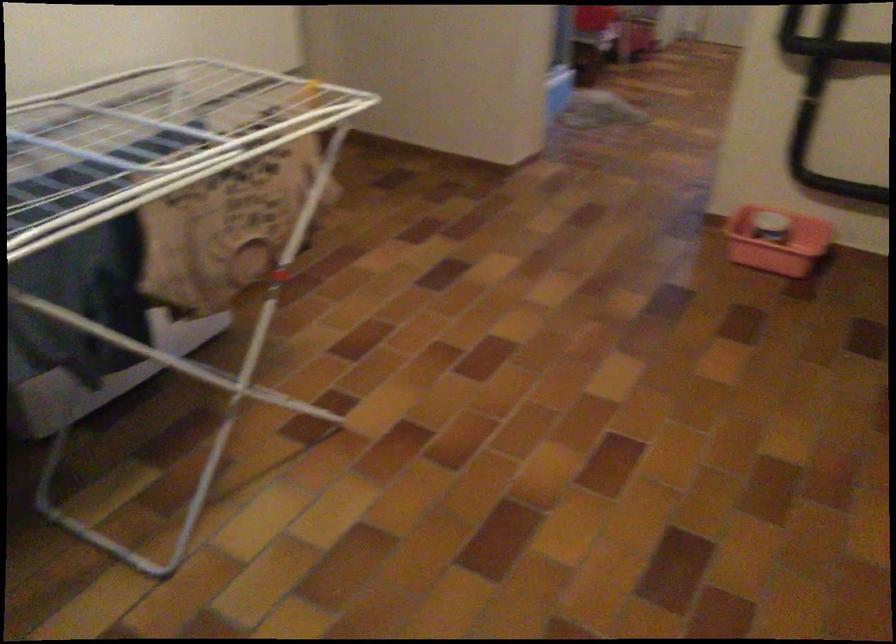
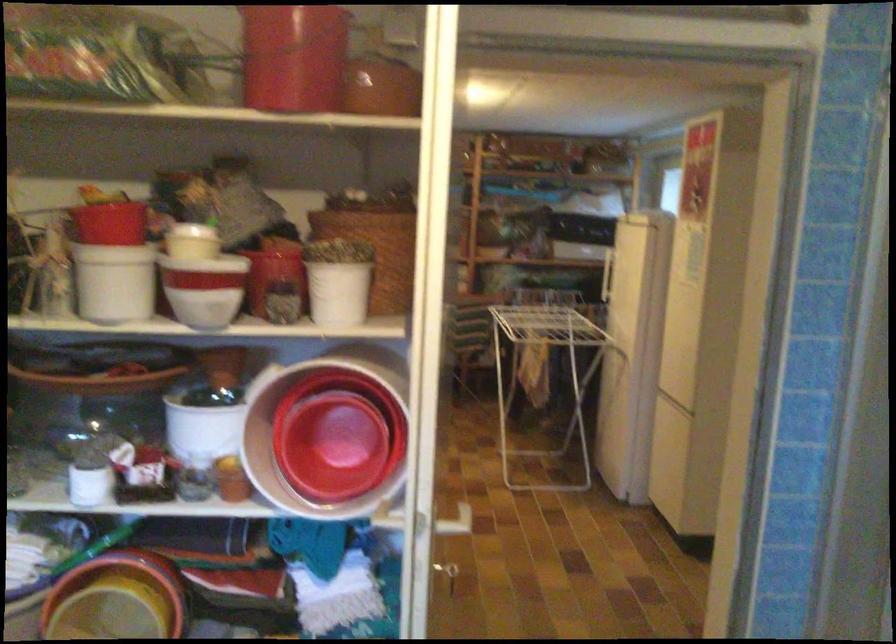
In the second image, find the point that corresponds to the point at 591,292 in the first image.

(449, 574)